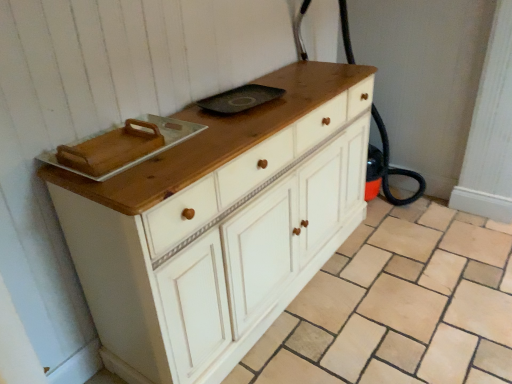
Image resolution: width=512 pixels, height=384 pixels. What are the coordinates of `vacant area on top of white wood cabinet at center (from a real-world perspective)` in the screenshot? It's located at (372, 298).